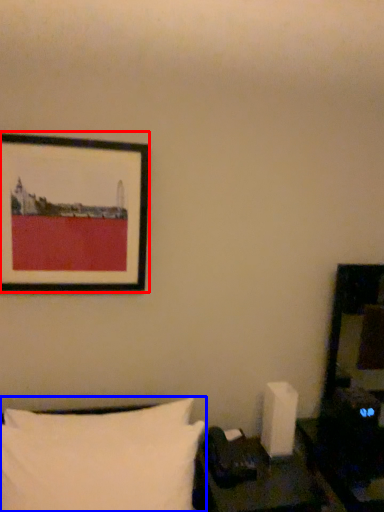
Question: Among these objects, which one is farthest to the camera, picture frame (highlighted by a red box) or pillow (highlighted by a blue box)?

Choices:
 (A) picture frame
 (B) pillow

Answer: (A)